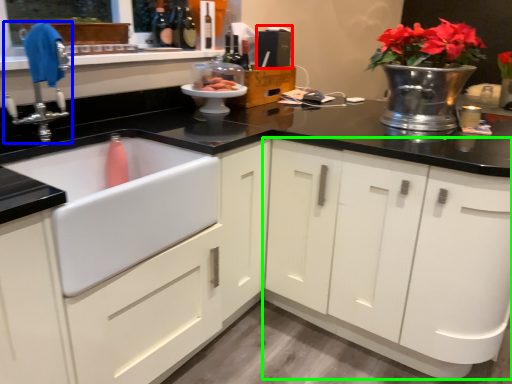
Question: Considering the real-world distances, which object is closest to appliance (highlighted by a red box)? tap (highlighted by a blue box) or cabinetry (highlighted by a green box).

Choices:
 (A) tap
 (B) cabinetry

Answer: (B)